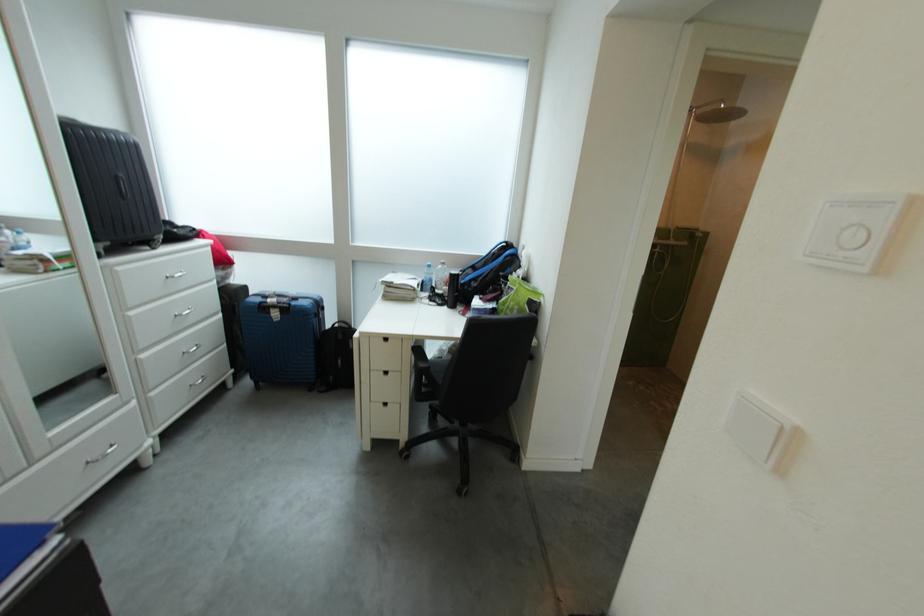
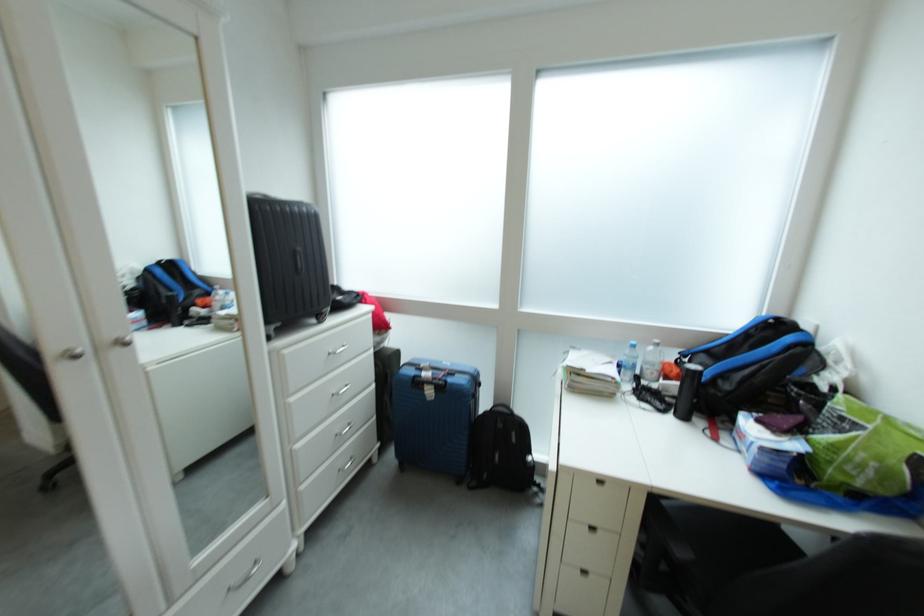
What movement of the cameraman would produce the second image?

The cameraman walked toward left, forward.